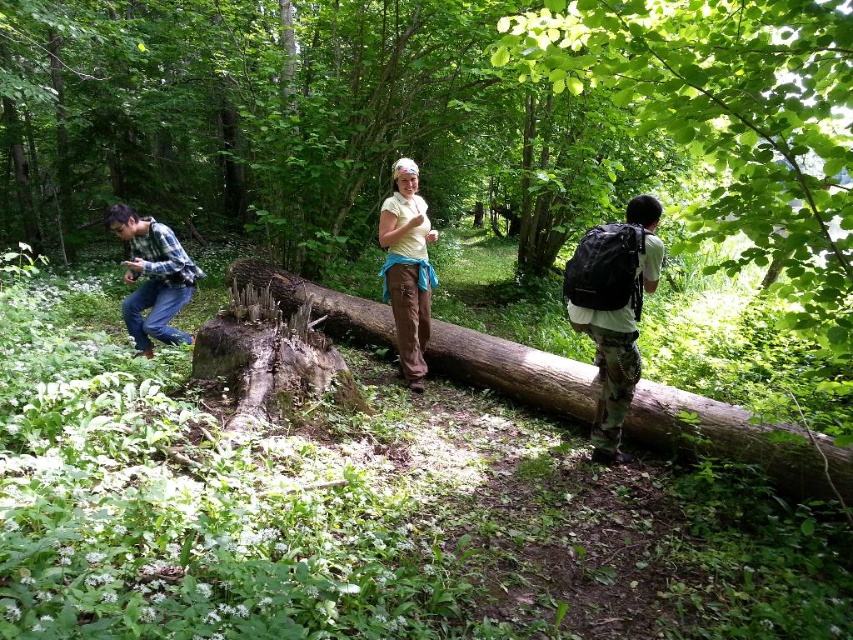
You are a hiker trying to cross the fallen tree trunk in the forest. You notice two points marked on the log. One is at point [402,168] and the other at point [395,225]. Which point is closer to you as you stand at the starting point of the log?

Point [402,168] is closer to the viewer than point [395,225], so the point at [402,168] is closer to you as you stand at the starting point of the log.

You are a photographer carrying the brushed metal camera at left and want to take a photo of the brown rough log at center. Since the log is larger than the camera, will you need to step back to capture the entire log in your photo?

The brown rough log at center has a larger size compared to brushed metal camera at left. To capture the entire log in your photo, you would need to step back to ensure the log fits within the camera frame.